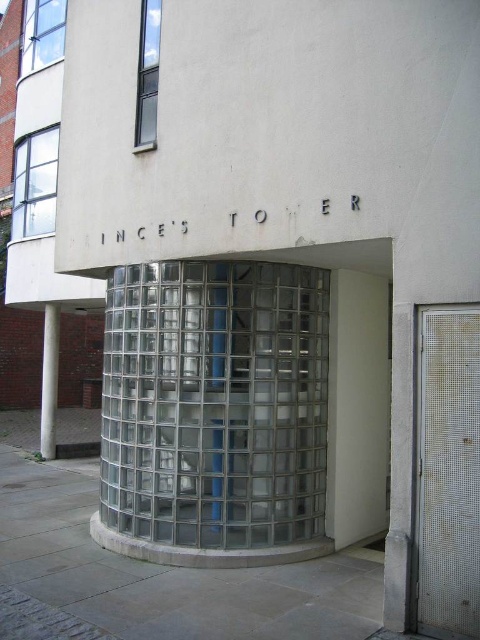
Does clear glass door at center have a greater height compared to metal mesh door at lower right?

Yes, clear glass door at center is taller than metal mesh door at lower right.

Is point (218, 424) more distant than point (477, 328)?

Yes, point (218, 424) is farther from viewer.

Is point (242, 269) farther from camera compared to point (455, 548)?

That is True.

The image size is (480, 640). In order to click on clear glass door at center in this screenshot , I will do `click(215, 403)`.

Who is lower down, metal mesh door at lower right or white marble column at left?

white marble column at left is lower down.

What do you see at coordinates (447, 472) in the screenshot? I see `metal mesh door at lower right` at bounding box center [447, 472].

Find the location of a particular element. The image size is (480, 640). metal mesh door at lower right is located at coordinates (447, 472).

Is clear glass door at center below white marble column at left?

Incorrect, clear glass door at center is not positioned below white marble column at left.

Is clear glass door at center in front of white marble column at left?

Yes, it is in front of white marble column at left.

Which is behind, point (308, 429) or point (59, 321)?

The point (59, 321) is more distant.

Identify the location of clear glass door at center. (215, 403).